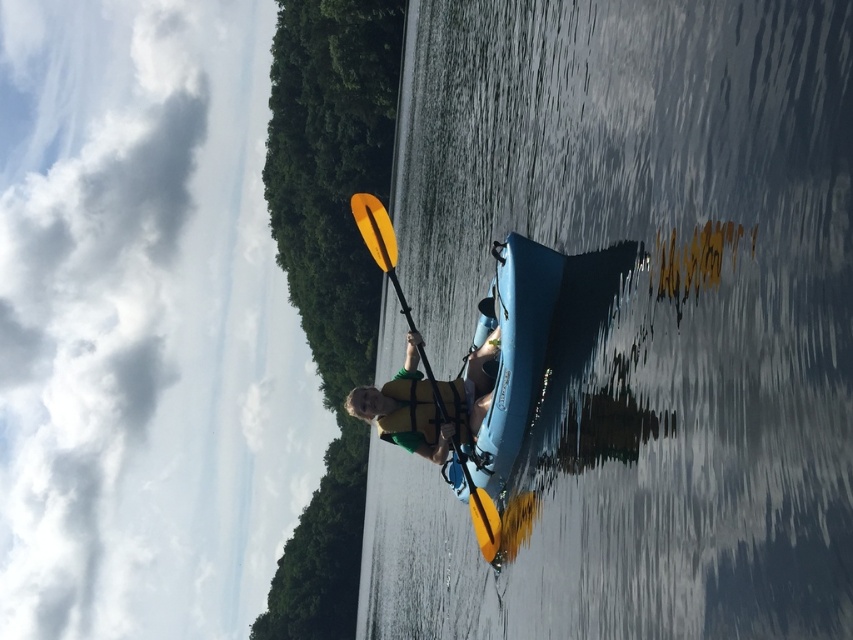
Does yellow life vest at center lie in front of yellow matte paddle at center?

That is True.

Does point (412, 340) come behind point (480, 513)?

That is True.

The width and height of the screenshot is (853, 640). I want to click on yellow life vest at center, so click(x=427, y=403).

Who is shorter, yellow life vest at center or green/yellow fabric life jacket at center?

green/yellow fabric life jacket at center is shorter.

How far apart are yellow life vest at center and green/yellow fabric life jacket at center?

The distance of yellow life vest at center from green/yellow fabric life jacket at center is 5.50 inches.

Which is in front, point (456, 385) or point (463, 435)?

Positioned in front is point (463, 435).

Where is `yellow life vest at center`? The width and height of the screenshot is (853, 640). yellow life vest at center is located at coordinates (427, 403).

Which is in front, point (466, 400) or point (389, 248)?

Point (466, 400)

Does green/yellow fabric life jacket at center appear on the right side of yellow matte paddle at center?

Yes, green/yellow fabric life jacket at center is to the right of yellow matte paddle at center.

Image resolution: width=853 pixels, height=640 pixels. I want to click on green/yellow fabric life jacket at center, so click(x=409, y=412).